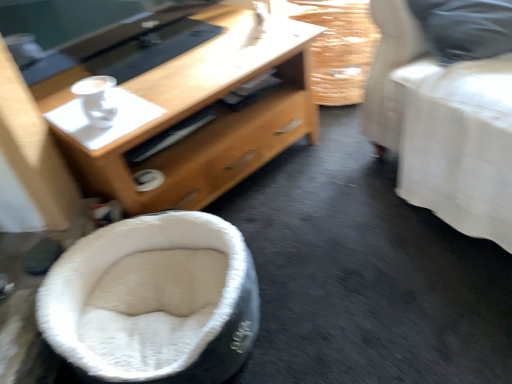
I want to click on free point behind white glossy cup at upper left, so click(141, 84).